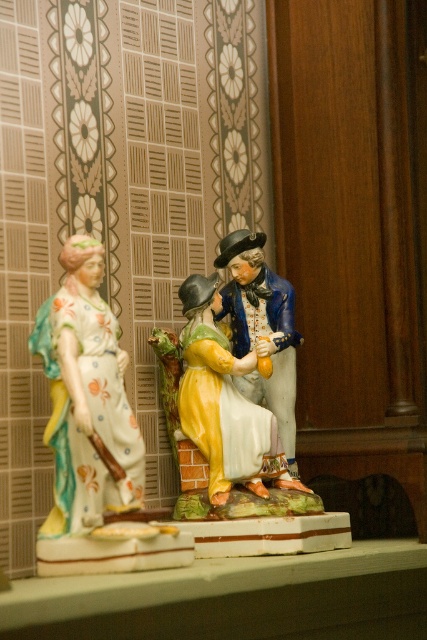
Question: Is porcelain figurine at left below porcelain figure at center?

Choices:
 (A) yes
 (B) no

Answer: (A)

Question: Which point is farther to the camera?

Choices:
 (A) (271, 333)
 (B) (96, 490)

Answer: (A)

Question: Which point appears farthest from the camera in this image?

Choices:
 (A) (286, 336)
 (B) (119, 504)

Answer: (A)

Question: Is porcelain figurine at left smaller than porcelain figure at center?

Choices:
 (A) no
 (B) yes

Answer: (A)

Question: Is porcelain figurine at left smaller than porcelain figure at center?

Choices:
 (A) yes
 (B) no

Answer: (B)